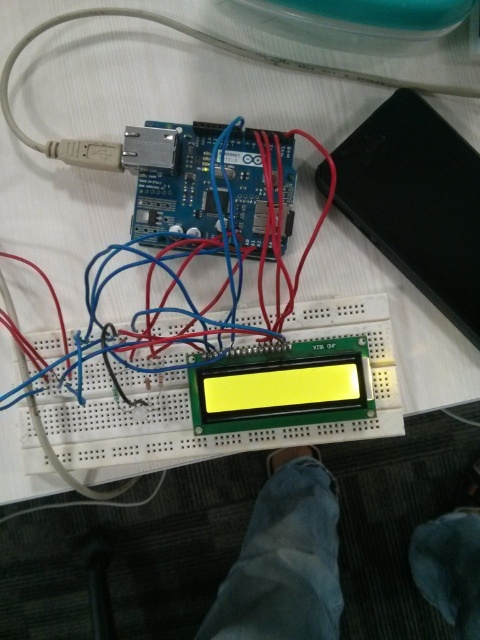
Does point (466, 538) lie in front of point (119, 147)?

No, it is behind (119, 147).

The height and width of the screenshot is (640, 480). What do you see at coordinates (285, 557) in the screenshot? I see `jeans at lower center` at bounding box center [285, 557].

Is point (228, 582) farther from viewer compared to point (66, 161)?

Yes, point (228, 582) is behind point (66, 161).

This screenshot has width=480, height=640. Identify the location of jeans at lower center. (285, 557).